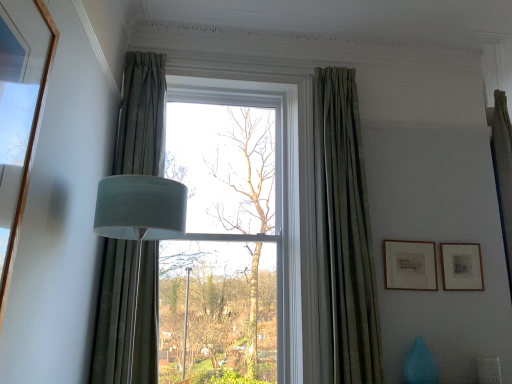
Question: From the image's perspective, is matte blue vase at lower right located above or below matte black picture frame at right, which ranks as the second picture frame in left-to-right order?

Choices:
 (A) below
 (B) above

Answer: (A)

Question: From a real-world perspective, is matte blue vase at lower right positioned above or below matte black picture frame at right, which ranks as the second picture frame in left-to-right order?

Choices:
 (A) above
 (B) below

Answer: (B)

Question: Which of these objects is positioned farthest from the green fabric curtain at left, positioned as the 2th curtain in right-to-left order?

Choices:
 (A) matte glass window at center
 (B) matte gold picture frame at right, the second picture frame in the right-to-left sequence
 (C) green velvet curtain at center, acting as the second curtain starting from the left
 (D) matte black picture frame at right, which appears as the first picture frame when viewed from the right
 (E) matte blue vase at lower right

Answer: (D)

Question: Estimate the real-world distances between objects in this image. Which object is farther from the matte black picture frame at right, which ranks as the second picture frame in left-to-right order?

Choices:
 (A) green velvet curtain at center, which is the first curtain in right-to-left order
 (B) matte blue vase at lower right
 (C) matte gold picture frame at right, the second picture frame in the right-to-left sequence
 (D) green fabric curtain at left, positioned as the 2th curtain in right-to-left order
 (E) matte glass window at center

Answer: (D)